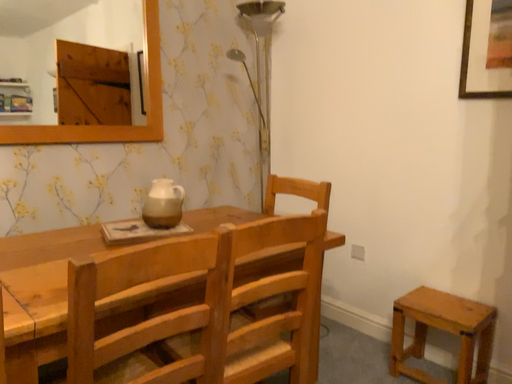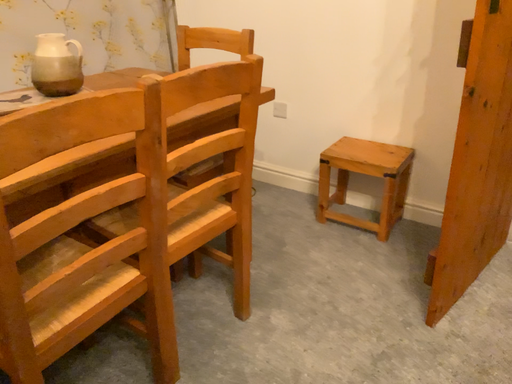
Question: How did the camera likely rotate when shooting the video?

Choices:
 (A) rotated upward
 (B) rotated downward

Answer: (B)